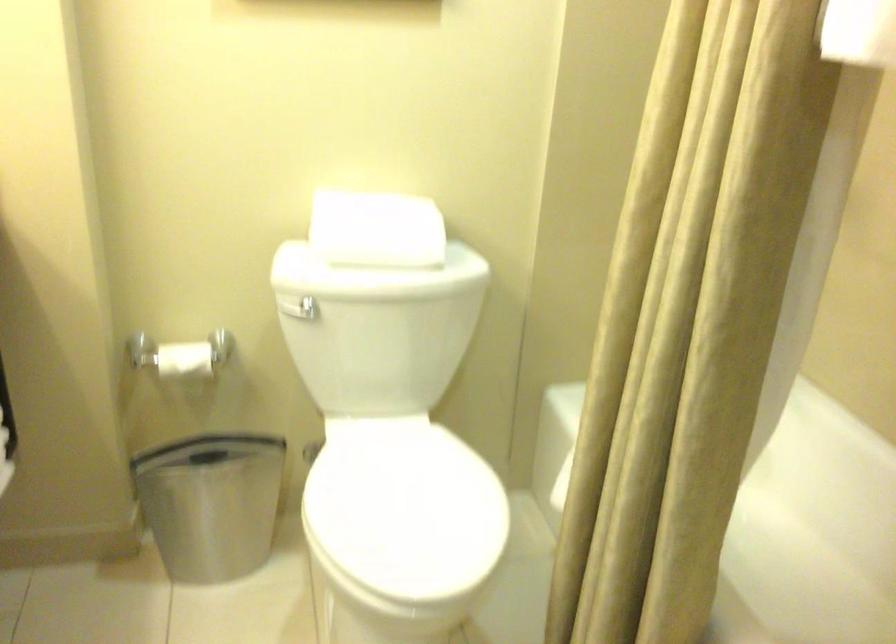
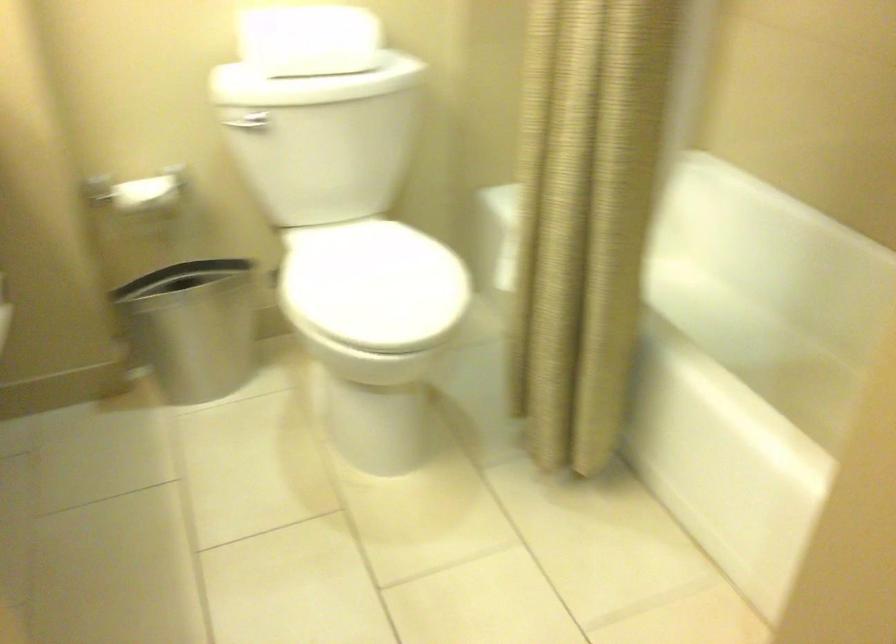
The point at (187, 361) is marked in the first image. Where is the corresponding point in the second image?

(147, 193)